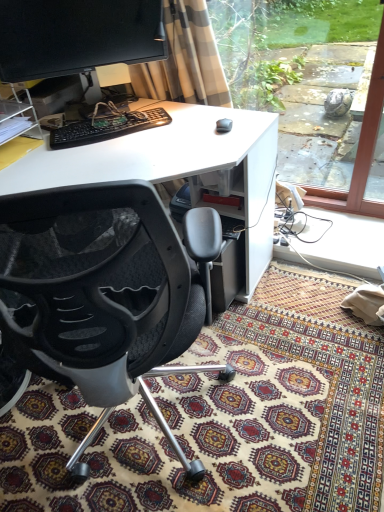
Locate an element on the screen. free space that is to the left of black plastic keyboard at center is located at coordinates (41, 135).